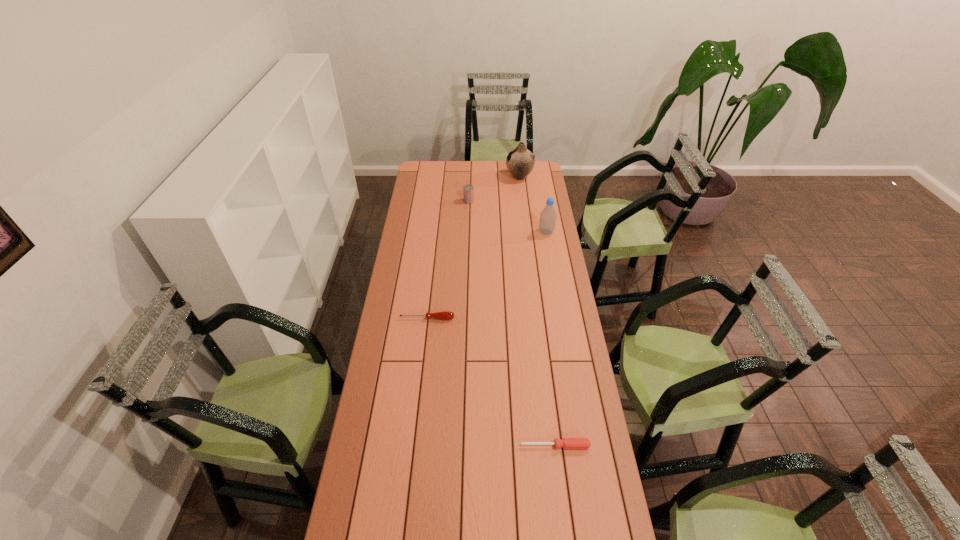
Identify the location of blank area in the image that satisfies the following two spatial constraints: 1. from the spout of the farthest object; 2. on the back side of the nearest object. (552, 446).